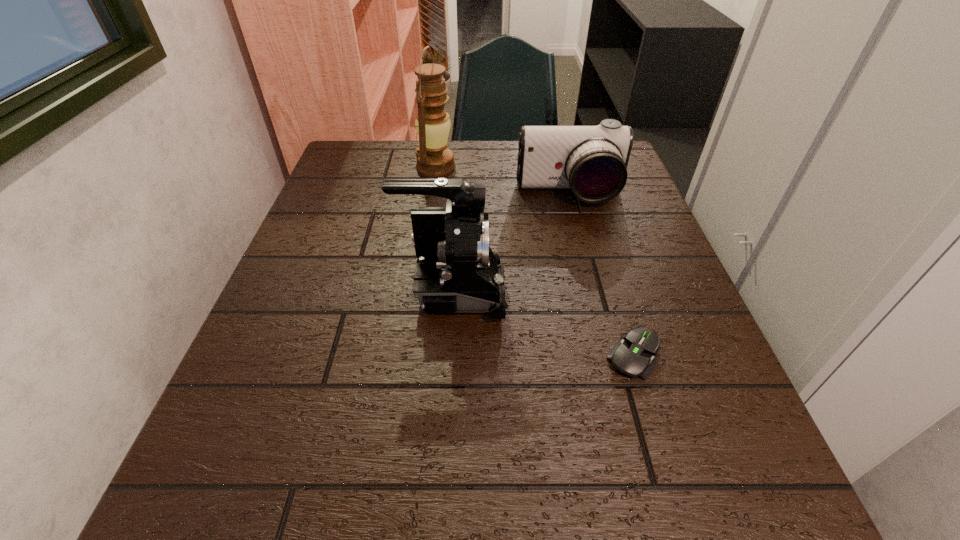
The width and height of the screenshot is (960, 540). In order to click on vacant space located on the front of the computer mouse in this screenshot , I will do `click(678, 500)`.

Image resolution: width=960 pixels, height=540 pixels. In order to click on oil lamp located in the far edge section of the desktop in this screenshot , I will do `click(434, 159)`.

Find the location of a particular element. This screenshot has height=540, width=960. camcorder located at the far edge is located at coordinates (592, 161).

This screenshot has height=540, width=960. In order to click on camcorder that is at the right edge in this screenshot , I will do `click(592, 161)`.

The height and width of the screenshot is (540, 960). I want to click on computer mouse located in the right edge section of the desktop, so click(632, 356).

The height and width of the screenshot is (540, 960). What are the coordinates of `object located at the far right corner` in the screenshot? It's located at (592, 161).

In the image, there is a desktop. Identify the location of vacant space at the far edge. (396, 170).

At what (x,y) coordinates should I click in order to perform the action: click on vacant region at the near edge of the desktop. Please return your answer as a coordinate pair (x, y). The image size is (960, 540). Looking at the image, I should click on (525, 523).

The height and width of the screenshot is (540, 960). I want to click on vacant space at the left edge of the desktop, so click(361, 241).

I want to click on vacant space at the right edge of the desktop, so click(x=660, y=421).